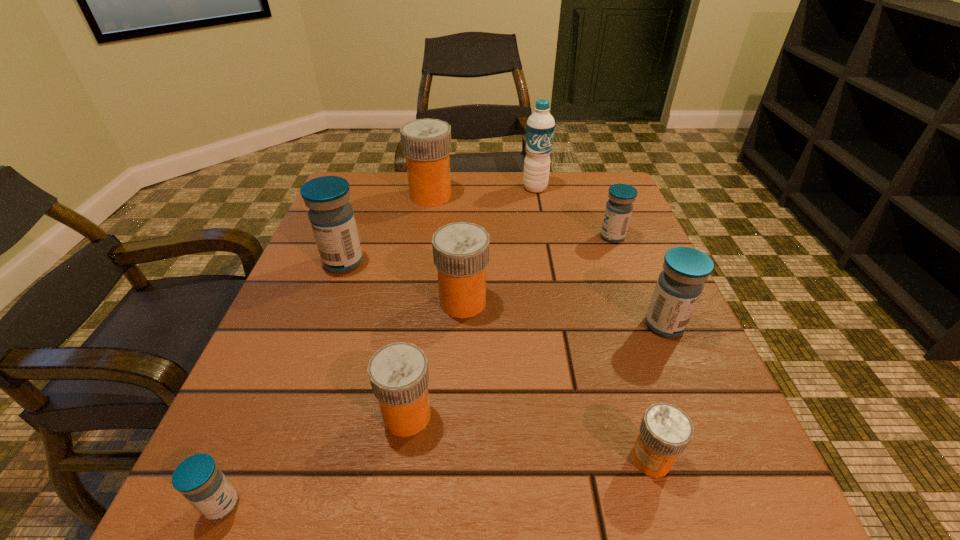
Locate an element on the screen. vacant area between the second farthest blue medicine and the biggest orange medicine is located at coordinates (387, 229).

Identify the location of vacant space that's between the seventh object from left to right and the third biggest orange medicine. Image resolution: width=960 pixels, height=540 pixels. point(529,437).

Find the location of `free space between the second farthest orange medicine and the second biggest blue medicine`. free space between the second farthest orange medicine and the second biggest blue medicine is located at coordinates (564, 313).

Find the location of a particular element. The height and width of the screenshot is (540, 960). unoccupied area between the smallest orange medicine and the second smallest orange medicine is located at coordinates (529, 437).

Locate which object ranks second in proximity to the second farthest orange medicine. Please provide its 2D coordinates. Your answer should be formatted as a tuple, i.e. [(x, y)], where the tuple contains the x and y coordinates of a point satisfying the conditions above.

[(332, 219)]

Identify which object is located as the eighth nearest to the farthest medicine. Please provide its 2D coordinates. Your answer should be formatted as a tuple, i.e. [(x, y)], where the tuple contains the x and y coordinates of a point satisfying the conditions above.

[(203, 484)]

Identify which medicine is located as the eighth nearest to the water bottle. Please provide its 2D coordinates. Your answer should be formatted as a tuple, i.e. [(x, y)], where the tuple contains the x and y coordinates of a point satisfying the conditions above.

[(203, 484)]

Locate an element on the screen. Image resolution: width=960 pixels, height=540 pixels. the closest medicine to the third farthest object is located at coordinates (681, 282).

This screenshot has width=960, height=540. What are the coordinates of `orange medicine that stands as the closest to the second smallest orange medicine` in the screenshot? It's located at (460, 250).

Locate an element on the screen. The width and height of the screenshot is (960, 540). orange medicine that is the third closest to the third smallest blue medicine is located at coordinates (399, 375).